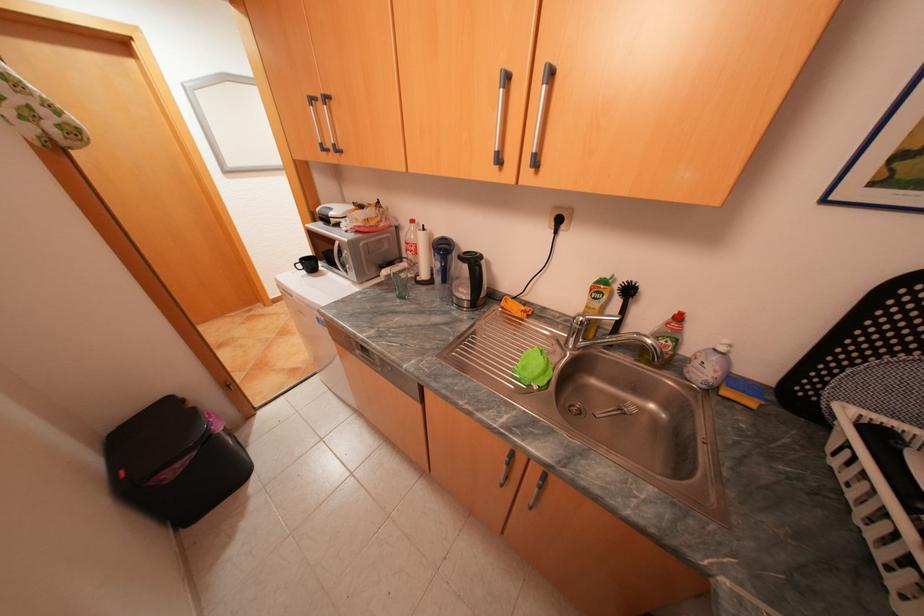
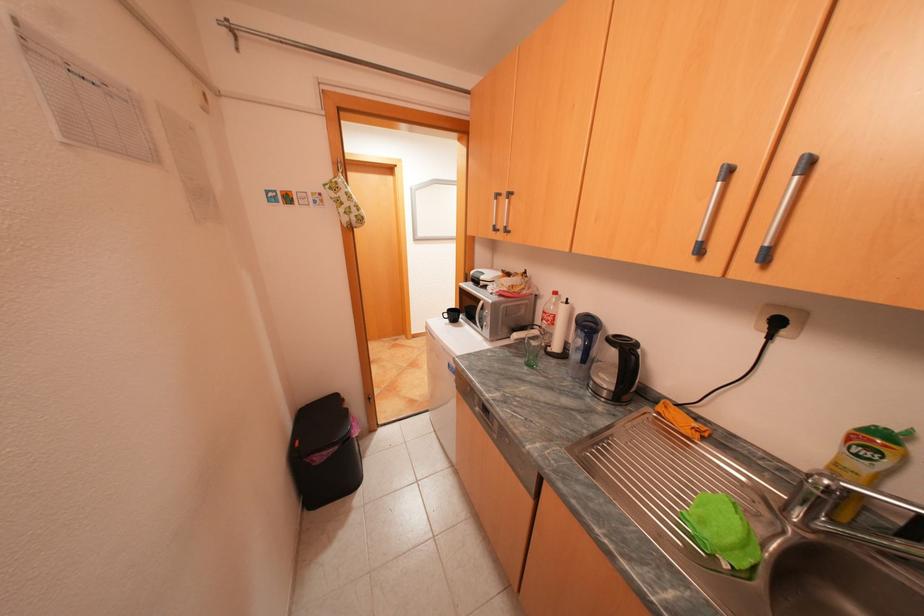
Locate, in the second image, the point that corresponds to (x=403, y=294) in the first image.

(530, 360)